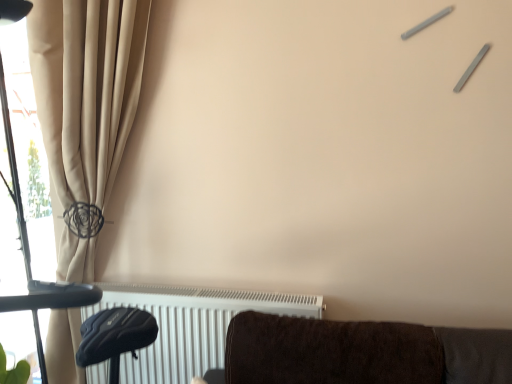
Question: Is white metallic radiator at lower center in front of or behind beige fabric curtain at left in the image?

Choices:
 (A) front
 (B) behind

Answer: (B)

Question: Is white metallic radiator at lower center spatially inside beige fabric curtain at left, or outside of it?

Choices:
 (A) outside
 (B) inside

Answer: (B)

Question: Would you say white metallic radiator at lower center is to the left or to the right of beige fabric curtain at left in the picture?

Choices:
 (A) right
 (B) left

Answer: (A)

Question: Looking at the image, does beige fabric curtain at left seem bigger or smaller compared to white metallic radiator at lower center?

Choices:
 (A) big
 (B) small

Answer: (A)

Question: From the image's perspective, is beige fabric curtain at left above or below white metallic radiator at lower center?

Choices:
 (A) above
 (B) below

Answer: (A)

Question: From their relative heights in the image, would you say beige fabric curtain at left is taller or shorter than white metallic radiator at lower center?

Choices:
 (A) short
 (B) tall

Answer: (B)

Question: Considering the relative positions of beige fabric curtain at left and white metallic radiator at lower center in the image provided, is beige fabric curtain at left to the left or to the right of white metallic radiator at lower center?

Choices:
 (A) right
 (B) left

Answer: (B)